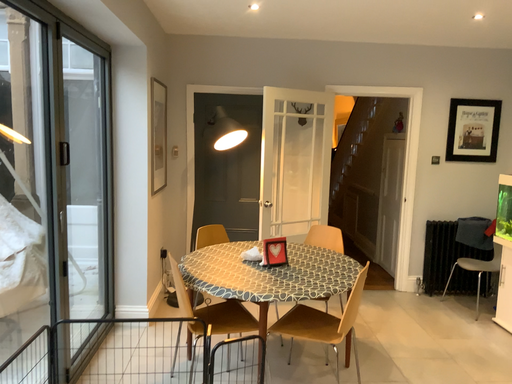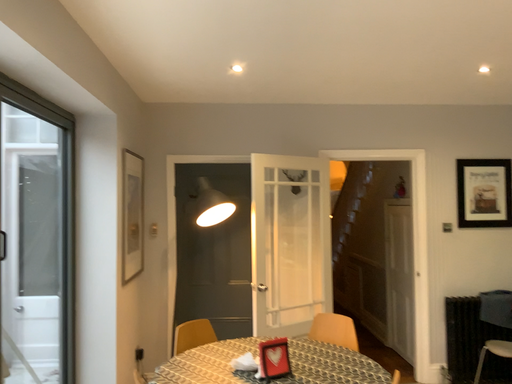
Question: How did the camera likely rotate when shooting the video?

Choices:
 (A) rotated downward
 (B) rotated upward

Answer: (B)